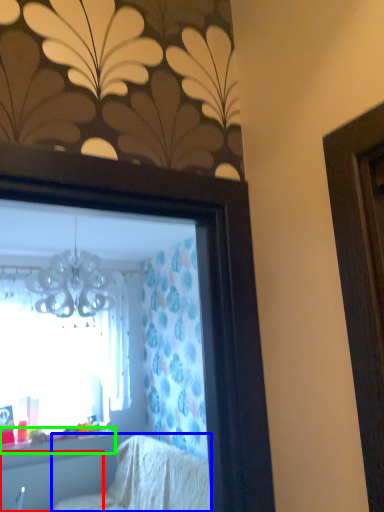
Question: Estimate the real-world distances between objects in this image. Which object is farther from radiator (highlighted by a red box), furniture (highlighted by a blue box) or window sill (highlighted by a green box)?

Choices:
 (A) furniture
 (B) window sill

Answer: (A)